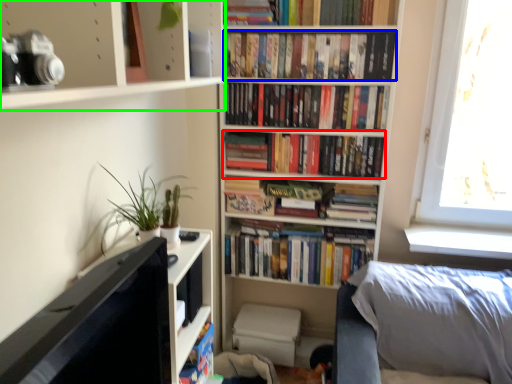
Question: Based on their relative distances, which object is nearer to book (highlighted by a red box)? Choose from book (highlighted by a blue box) and shelf (highlighted by a green box).

Choices:
 (A) book
 (B) shelf

Answer: (A)